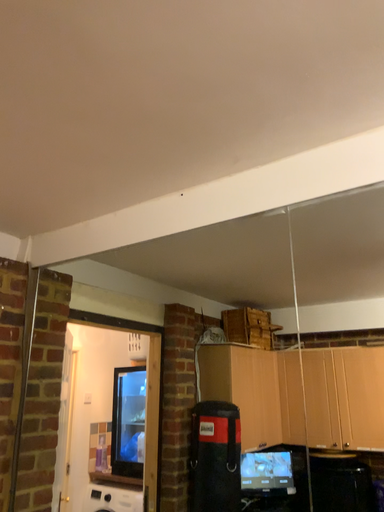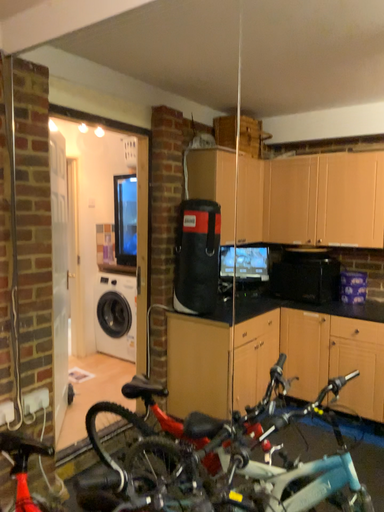
Question: How did the camera likely rotate when shooting the video?

Choices:
 (A) rotated downward
 (B) rotated upward

Answer: (A)